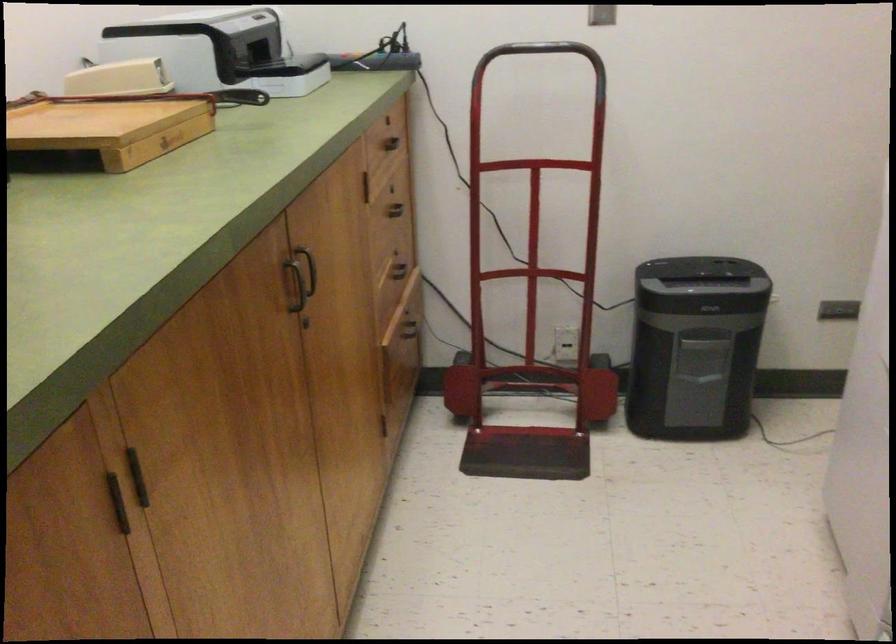
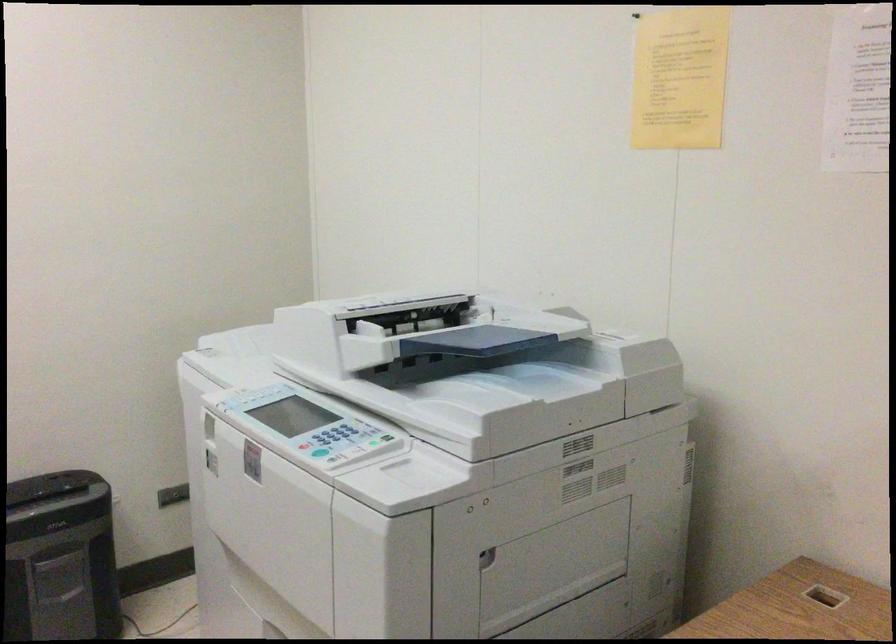
Question: The first image is from the beginning of the video and the second image is from the end. How did the camera likely rotate when shooting the video?

Choices:
 (A) Left
 (B) Right
 (C) Up
 (D) Down

Answer: (B)